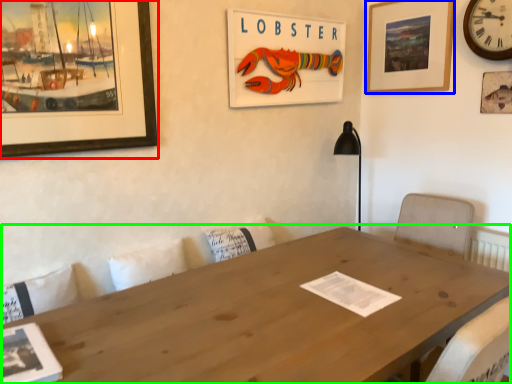
Question: Estimate the real-world distances between objects in this image. Which object is closer to picture frame (highlighted by a red box), picture frame (highlighted by a blue box) or table (highlighted by a green box)?

Choices:
 (A) picture frame
 (B) table

Answer: (B)